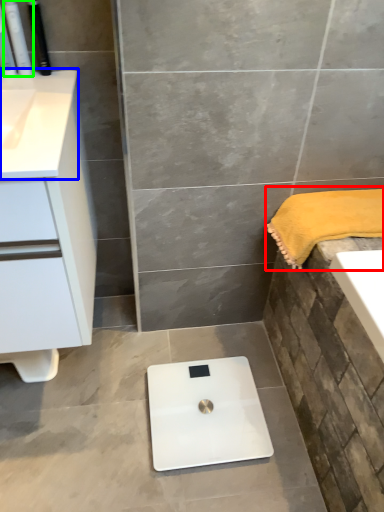
Question: Which object is the closest to the bath towel (highlighted by a red box)? Choose among these: counter top (highlighted by a blue box) or toiletry (highlighted by a green box).

Choices:
 (A) counter top
 (B) toiletry

Answer: (A)